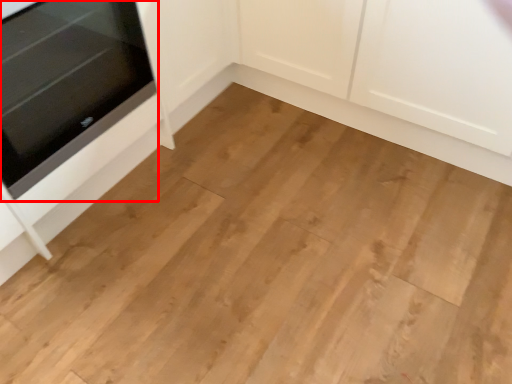
Question: From the image's perspective, considering the relative positions of oven (annotated by the red box) and cabinetry in the image provided, where is oven (annotated by the red box) located with respect to the staircase?

Choices:
 (A) below
 (B) above

Answer: (A)